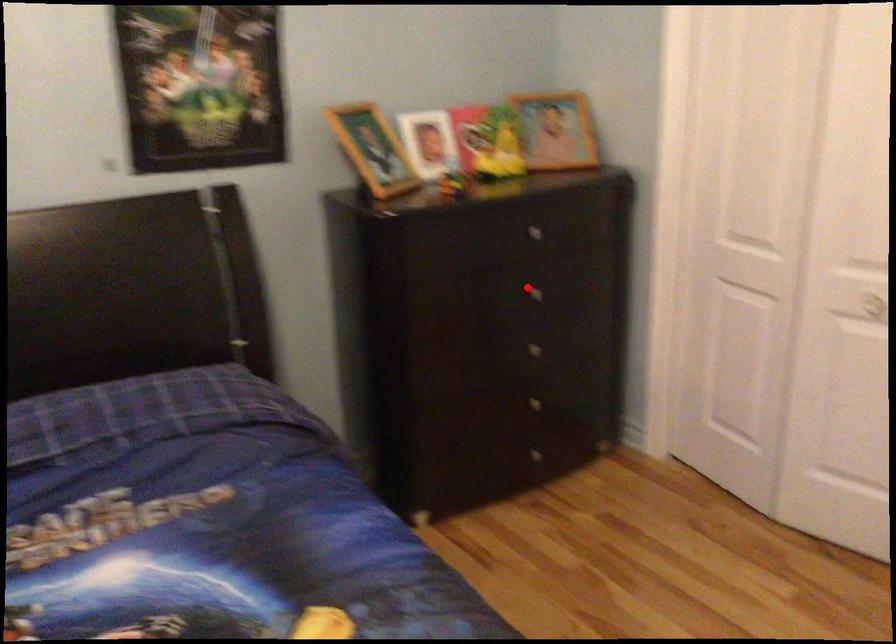
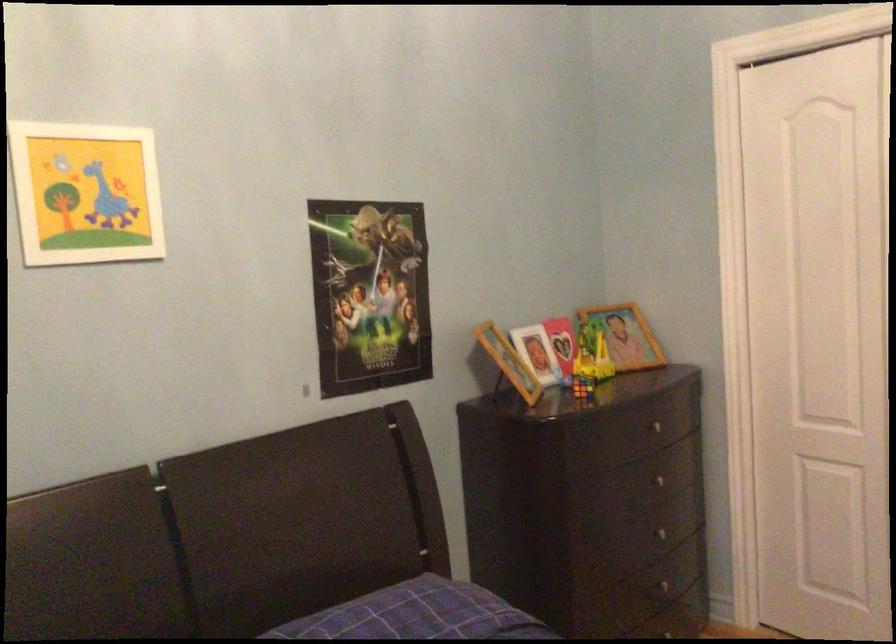
Where in the second image is the point corresponding to the highlighted location from the first image?

(656, 480)